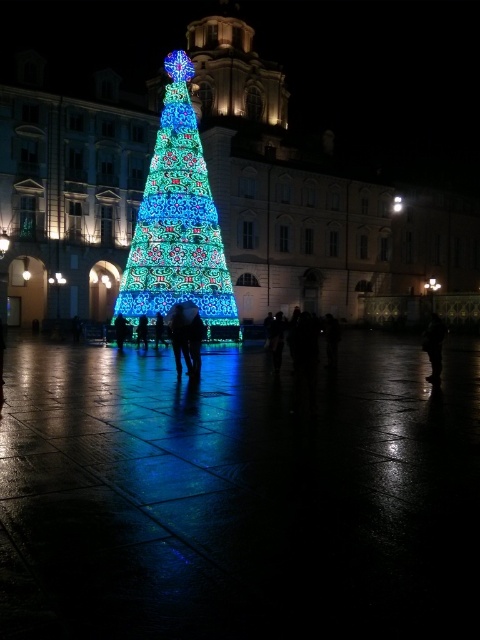
Question: Which object appears farthest from the camera in this image?

Choices:
 (A) black matte person at lower right
 (B) smooth black figure at center
 (C) illuminated glass christmas tree at center

Answer: (C)

Question: Does illuminated plastic christmas tree at center have a smaller size compared to smooth black figure at center?

Choices:
 (A) no
 (B) yes

Answer: (A)

Question: Considering the real-world distances, which object is farthest from the smooth black figure at center?

Choices:
 (A) illuminated glass christmas tree at center
 (B) black matte person at lower right
 (C) illuminated plastic christmas tree at center

Answer: (B)

Question: Is smooth black figure at center wider than black matte person at lower right?

Choices:
 (A) no
 (B) yes

Answer: (A)

Question: Is illuminated plastic christmas tree at center further to camera compared to smooth black figure at center?

Choices:
 (A) no
 (B) yes

Answer: (A)

Question: Estimate the real-world distances between objects in this image. Which object is closer to the illuminated glass christmas tree at center?

Choices:
 (A) black matte person at lower right
 (B) illuminated plastic christmas tree at center

Answer: (B)